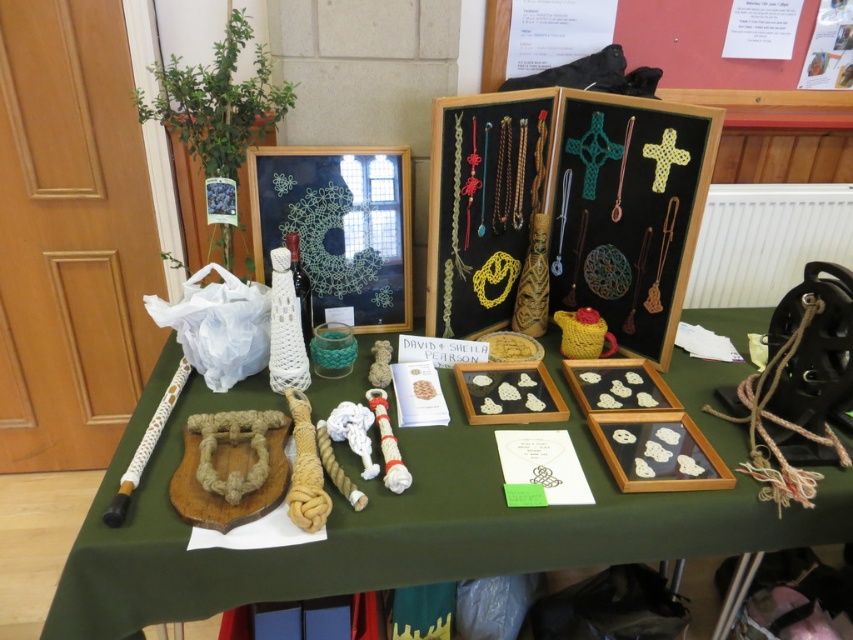
Question: Does natural fiber rope at left have a lesser width compared to matte black frame at center?

Choices:
 (A) yes
 (B) no

Answer: (B)

Question: Which point is farther to the camera?

Choices:
 (A) (181, 550)
 (B) (693, 212)

Answer: (B)

Question: Does natural fiber rope at left have a lesser width compared to matte black frame at center?

Choices:
 (A) yes
 (B) no

Answer: (B)

Question: Which point appears closest to the camera in this image?

Choices:
 (A) (693, 506)
 (B) (447, 236)

Answer: (A)

Question: Which of the following is the closest to the observer?

Choices:
 (A) (474, 308)
 (B) (704, 502)

Answer: (B)

Question: From the image, what is the correct spatial relationship of natural fiber rope at left in relation to matte black frame at center?

Choices:
 (A) below
 (B) above

Answer: (A)